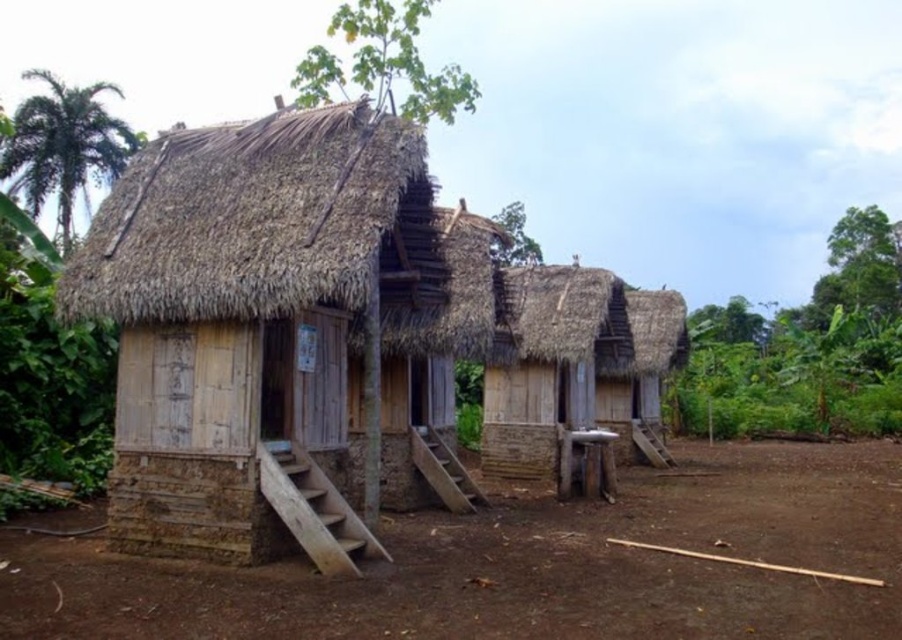
Question: Which object is positioned closest to the wooden hut at left?

Choices:
 (A) thatched straw roof at upper left
 (B) green leafy vegetation at right

Answer: (A)

Question: Where is wooden hut at left located in relation to green leafy vegetation at right in the image?

Choices:
 (A) below
 (B) above

Answer: (A)

Question: Is thatched straw roof at upper left closer to camera compared to green leafy vegetation at right?

Choices:
 (A) yes
 (B) no

Answer: (A)

Question: Which of the following is the closest to the observer?

Choices:
 (A) tap(376, 136)
 (B) tap(181, 390)
 (C) tap(253, 605)
 (D) tap(882, 417)

Answer: (C)

Question: Which of the following is the closest to the observer?

Choices:
 (A) brown dirt field at lower center
 (B) wooden hut at left
 (C) green leafy vegetation at right
 (D) thatched straw roof at upper left

Answer: (A)

Question: Is thatched straw roof at upper left in front of green leafy vegetation at right?

Choices:
 (A) no
 (B) yes

Answer: (B)